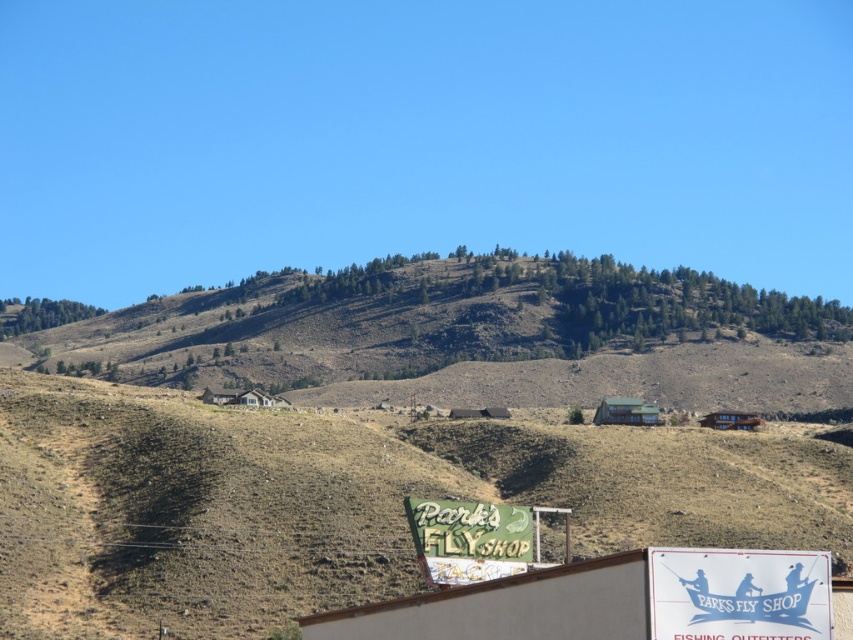
Between white paper sign at lower center and green painted wood sign at lower center, which one has more height?

With more height is green painted wood sign at lower center.

Who is more forward, (762, 563) or (416, 515)?

Point (762, 563) is in front.

Find the location of a particular element. white paper sign at lower center is located at coordinates 740,593.

Where is `white paper sign at lower center`? white paper sign at lower center is located at coordinates (740, 593).

Who is shorter, green textured hillside at upper center or white paper sign at lower center?

white paper sign at lower center

Is point (502, 300) positioned before point (808, 609)?

No, (502, 300) is behind (808, 609).

This screenshot has height=640, width=853. What are the coordinates of `green textured hillside at upper center` in the screenshot? It's located at (469, 337).

Can you confirm if green textured hillside at upper center is thinner than green painted wood sign at lower center?

No, green textured hillside at upper center is not thinner than green painted wood sign at lower center.

Does green textured hillside at upper center have a greater width compared to green painted wood sign at lower center?

Yes.

Between point (811, 312) and point (506, 518), which one is positioned in front?

Positioned in front is point (506, 518).

Where is `green textured hillside at upper center`? Image resolution: width=853 pixels, height=640 pixels. green textured hillside at upper center is located at coordinates (469, 337).